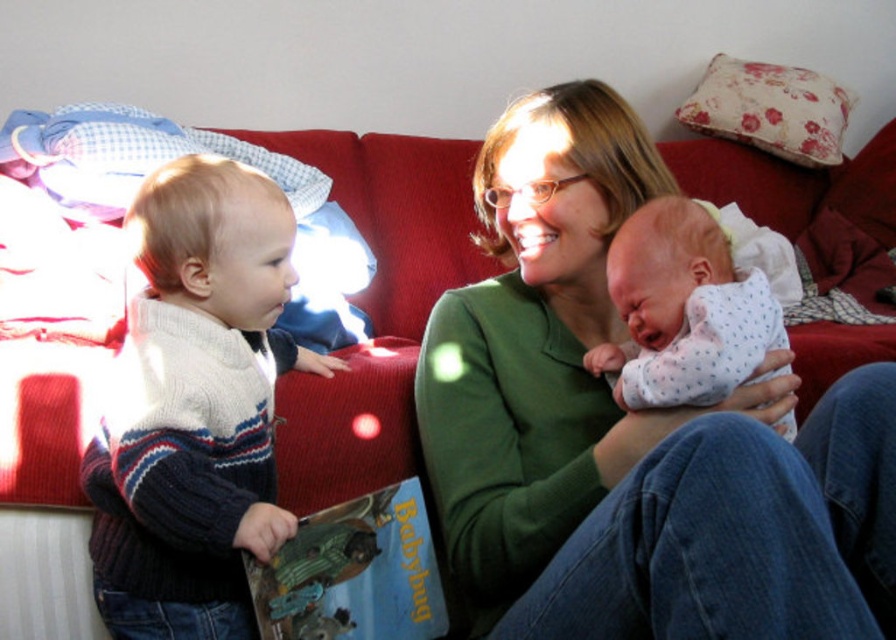
Question: Which point is farther to the camera?

Choices:
 (A) (593, 284)
 (B) (714, 262)
 (C) (412, 600)

Answer: (A)

Question: Does knitted sweater at left appear on the left side of white dotted fabric at center?

Choices:
 (A) yes
 (B) no

Answer: (A)

Question: Considering the relative positions of knitted sweater at left and white dotted fabric at center in the image provided, where is knitted sweater at left located with respect to white dotted fabric at center?

Choices:
 (A) above
 (B) below

Answer: (B)

Question: Is white dotted fabric at center to the left of hardcover book at lower left from the viewer's perspective?

Choices:
 (A) yes
 (B) no

Answer: (B)

Question: Based on their relative distances, which object is nearer to the knitted sweater at left?

Choices:
 (A) hardcover book at lower left
 (B) white dotted fabric at center
 (C) green soft sweater at center

Answer: (A)

Question: Which object is closer to the camera taking this photo?

Choices:
 (A) knitted sweater at left
 (B) hardcover book at lower left
 (C) white dotted fabric at center
 (D) green soft sweater at center

Answer: (D)